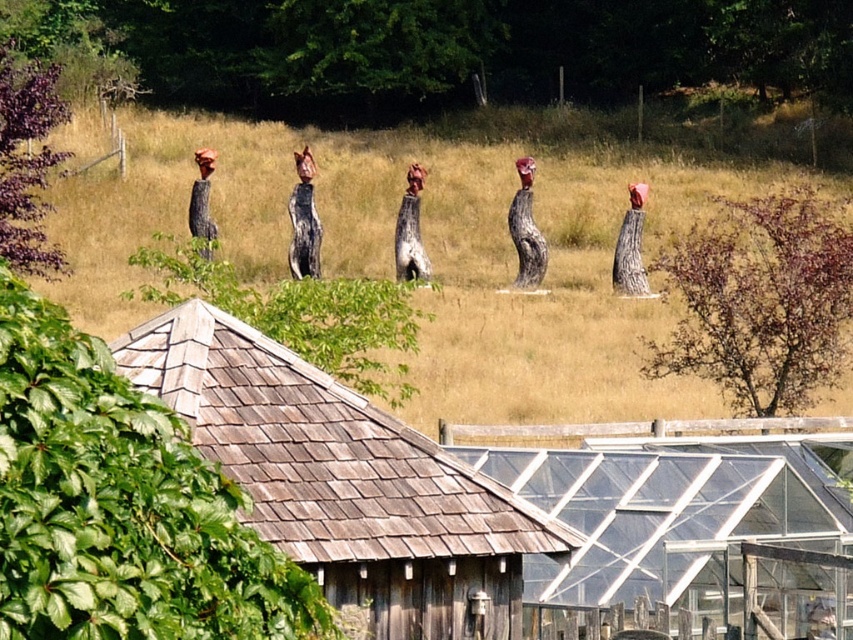
You are standing in the rural landscape and want to walk from the brown grass at center to the wooden hut at center. Which direction should you head?

The brown grass at center is positioned on the left side of the wooden hut at center, so you should head to the right to reach the wooden hut at center from the brown grass at center.

You are standing at the origin point of the image. Which direction should you move to reach the brown grass at center?

The brown grass at center is located at coordinates point (x=427, y=250), so you should move towards the center of the image to reach it.

You are standing in the field looking at the artistic tree trunks. You notice the wooden shingles at center and the wooden hut at center. Which object is closer to you?

The wooden shingles at center are closer to you because they are in front of the wooden hut at center.